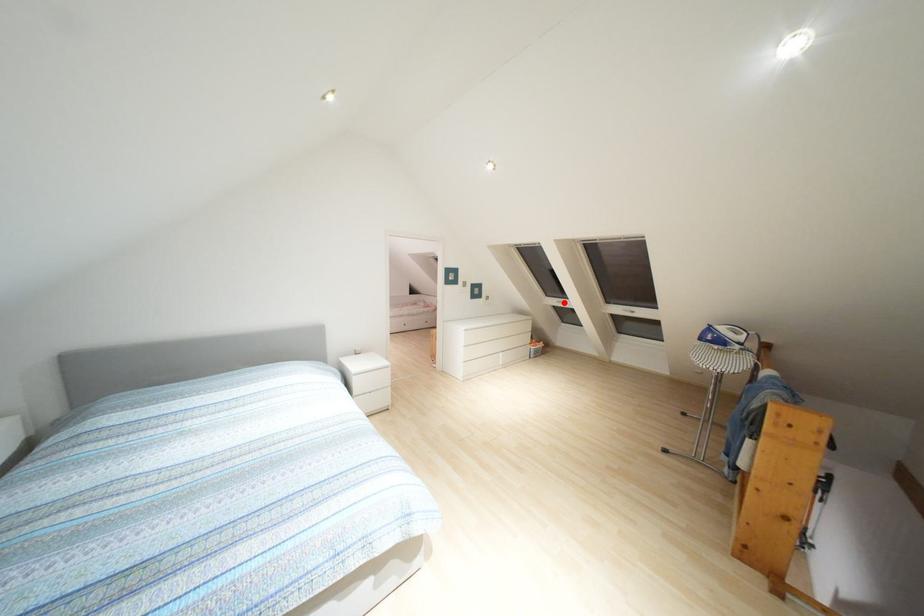
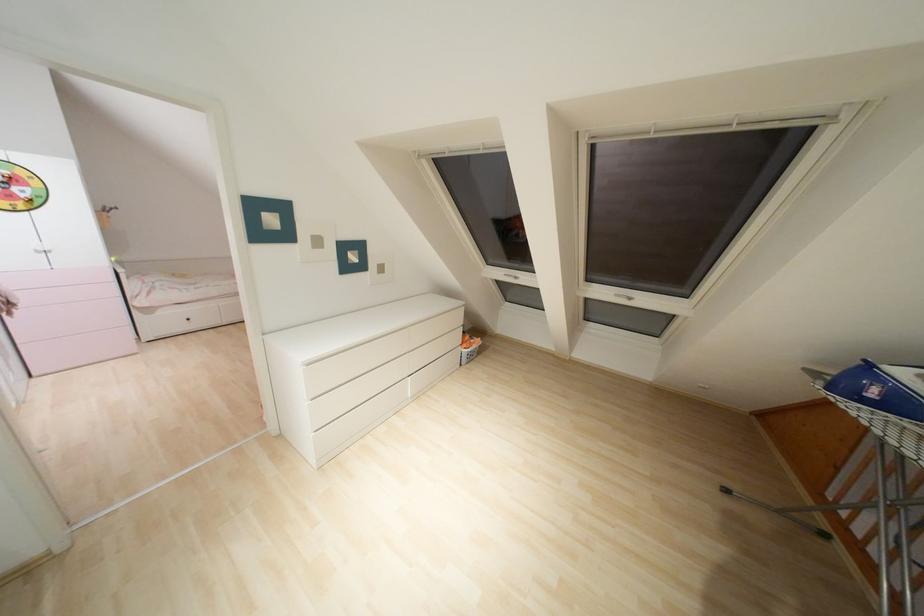
Where in the second image is the point corresponding to the highlighted location from the first image?

(515, 277)